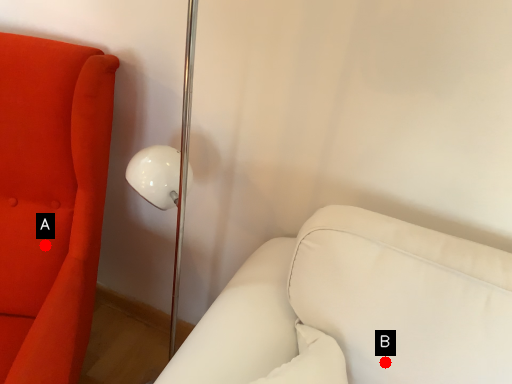
Question: Two points are circled on the image, labeled by A and B beside each circle. Which point is closer to the camera?

Choices:
 (A) A is closer
 (B) B is closer

Answer: (B)